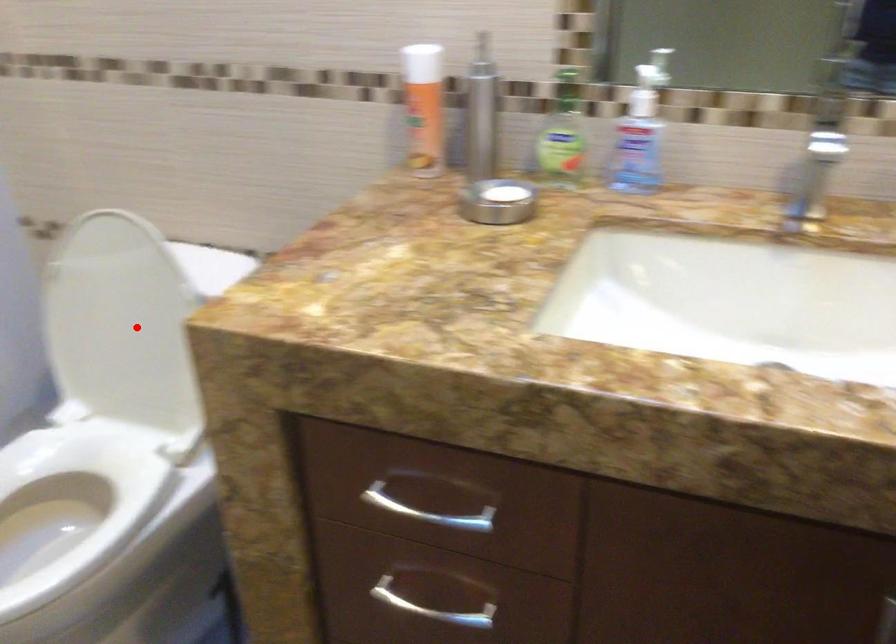
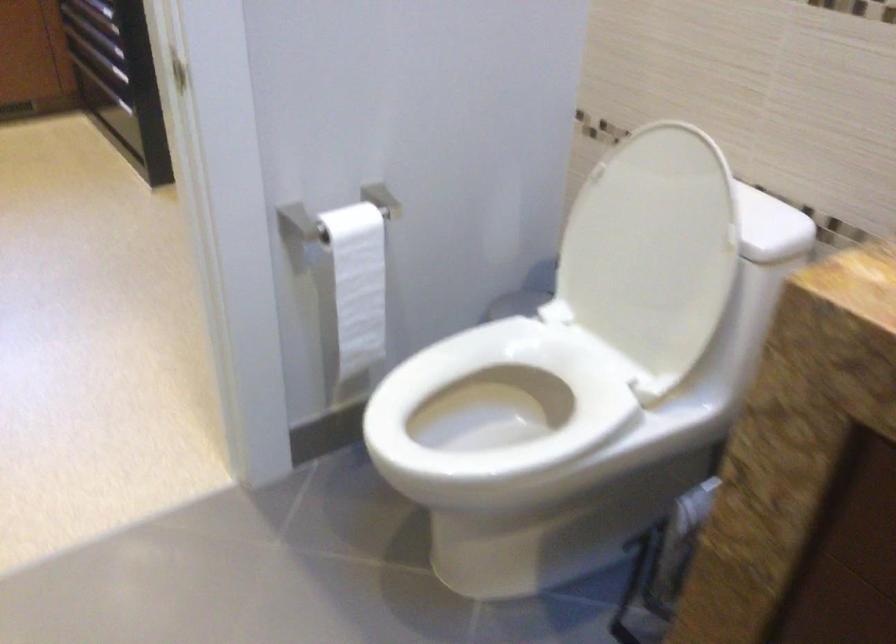
The point at the highlighted location is marked in the first image. Where is the corresponding point in the second image?

(652, 251)